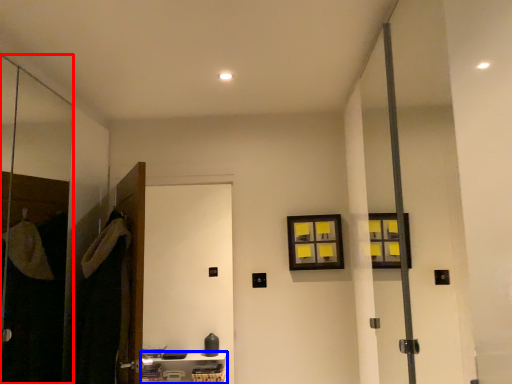
Question: Which object appears farthest to the camera in this image, screen door (highlighted by a red box) or furniture (highlighted by a blue box)?

Choices:
 (A) screen door
 (B) furniture

Answer: (B)